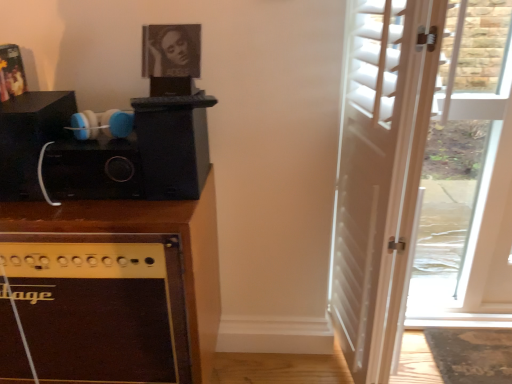
Question: Is white wood door at right in front of or behind matte black picture frame at upper center in the image?

Choices:
 (A) behind
 (B) front

Answer: (B)

Question: Do you think white wood door at right is within matte black picture frame at upper center, or outside of it?

Choices:
 (A) inside
 (B) outside

Answer: (B)

Question: Which of these objects is positioned closest to the brown wood cabinet at left?

Choices:
 (A) white wood door at right
 (B) matte black picture frame at upper center

Answer: (B)

Question: Which of these objects is positioned farthest from the brown wood cabinet at left?

Choices:
 (A) white wood door at right
 (B) matte black picture frame at upper center

Answer: (A)